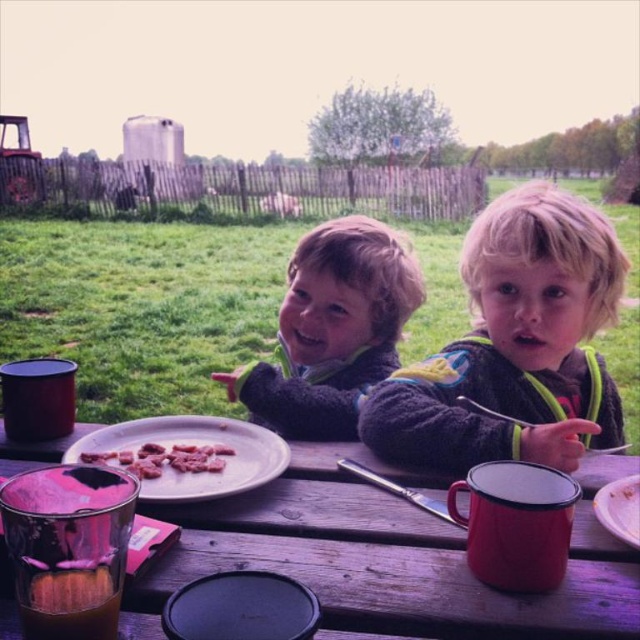
Question: Is pinkish matte meat at center above white matte plate at lower right?

Choices:
 (A) no
 (B) yes

Answer: (B)

Question: Can you confirm if white matte plate at center is smaller than white matte plate at lower right?

Choices:
 (A) yes
 (B) no

Answer: (B)

Question: Which point is farther to the camera?

Choices:
 (A) (161, 448)
 (B) (502, 216)
 (C) (216, 490)
 (D) (401, 266)

Answer: (D)

Question: Which object is farther from the camera taking this photo?

Choices:
 (A) pinkish matte meat at center
 (B) wooden table at center
 (C) white matte plate at center
 (D) soft gray sweater at center

Answer: (D)

Question: Considering the relative positions of wooden table at center and white matte plate at center in the image provided, where is wooden table at center located with respect to white matte plate at center?

Choices:
 (A) above
 (B) below

Answer: (B)

Question: Among these objects, which one is nearest to the camera?

Choices:
 (A) pinkish matte meat at center
 (B) wooden table at center

Answer: (B)